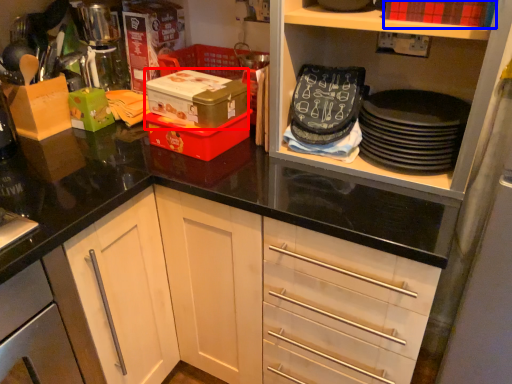
Question: Which point is further to the camera, box (highlighted by a red box) or box (highlighted by a blue box)?

Choices:
 (A) box
 (B) box

Answer: (A)